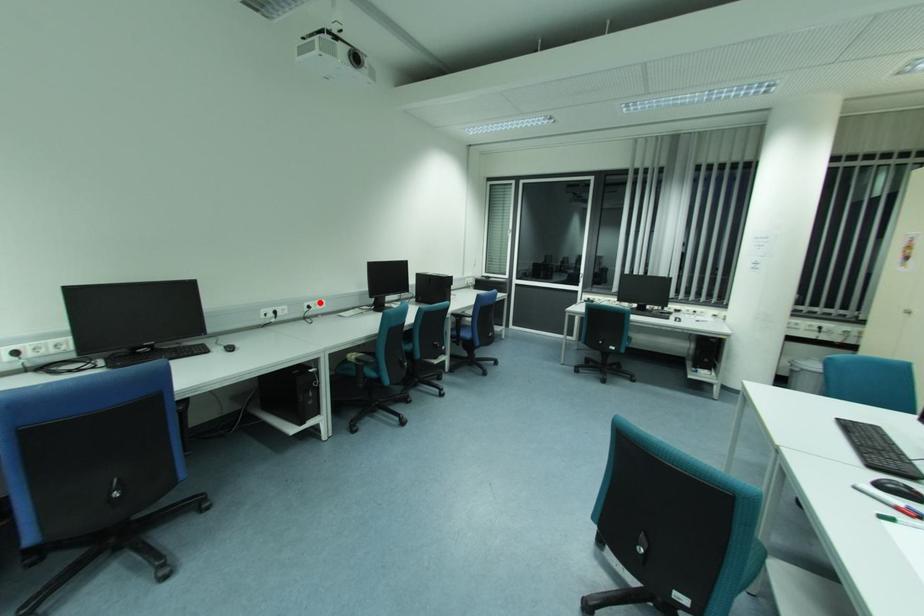
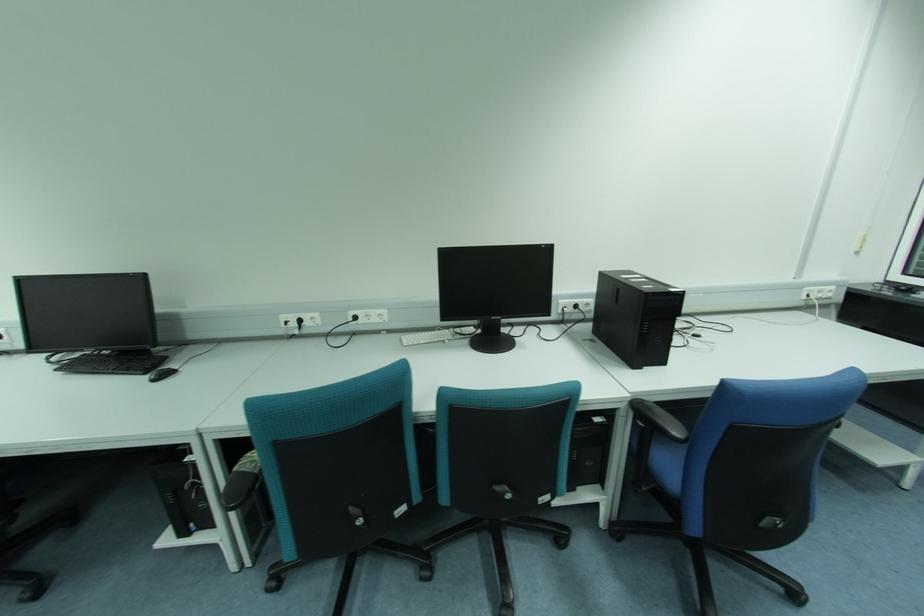
Question: A red point is marked in image1. In image2, is the corresponding 3D point closer to the camera or farther? Reply with the corresponding letter.

Choices:
 (A) The corresponding 3D point is closer.
 (B) The corresponding 3D point is farther.

Answer: (B)